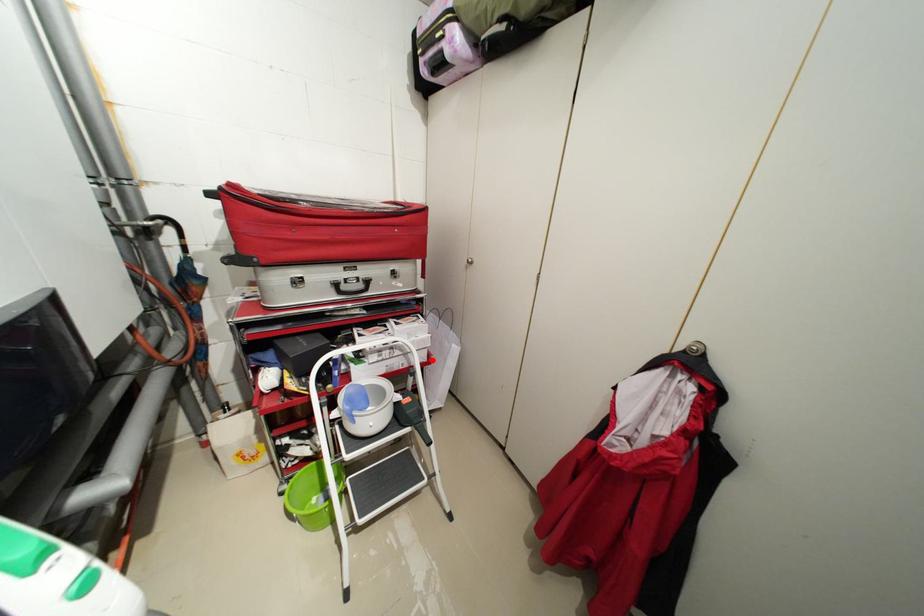
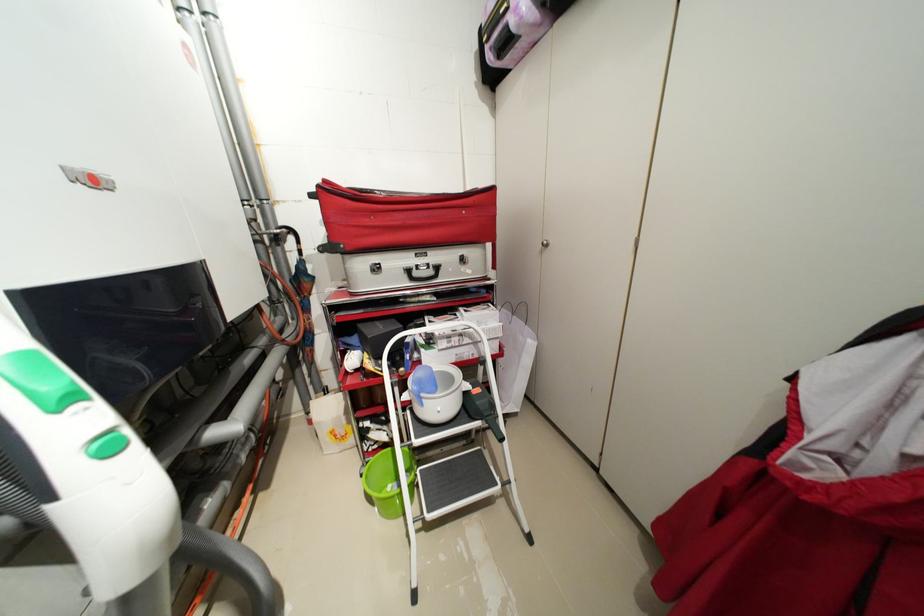
Locate, in the second image, the point that corresponds to the highlighted location in the first image.

(505, 352)